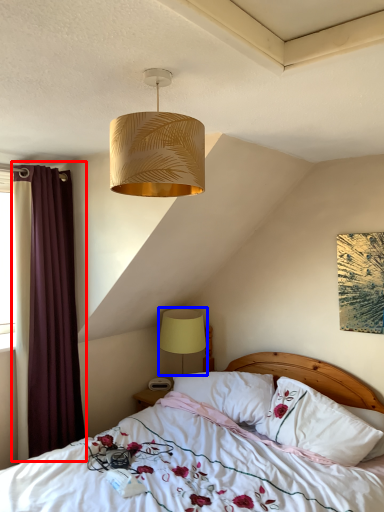
Question: Which of the following is the farthest to the observer, curtain (highlighted by a red box) or lamp (highlighted by a blue box)?

Choices:
 (A) curtain
 (B) lamp

Answer: (B)